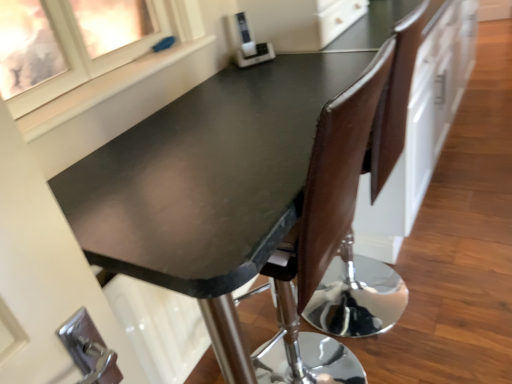
Question: Based on their positions, is white plastic appliance at upper center located to the left or right of matte black table at center?

Choices:
 (A) right
 (B) left

Answer: (B)

Question: From their relative heights in the image, would you say white plastic appliance at upper center is taller or shorter than matte black table at center?

Choices:
 (A) tall
 (B) short

Answer: (B)

Question: Which of these objects is positioned farthest from the matte glass window at upper left?

Choices:
 (A) matte black table at center
 (B) brown leather chair at center
 (C) white plastic appliance at upper center
 (D) white smooth window sill at upper left

Answer: (B)

Question: Estimate the real-world distances between objects in this image. Which object is farther from the matte black table at center?

Choices:
 (A) white plastic appliance at upper center
 (B) brown leather chair at center
 (C) matte glass window at upper left
 (D) white smooth window sill at upper left

Answer: (C)